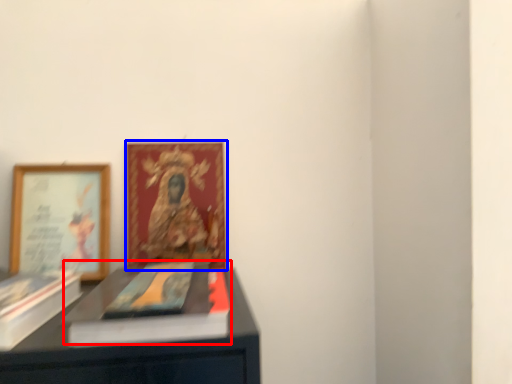
Question: Which of the following is the farthest to the observer, book cover (highlighted by a red box) or picture frame (highlighted by a blue box)?

Choices:
 (A) book cover
 (B) picture frame

Answer: (B)